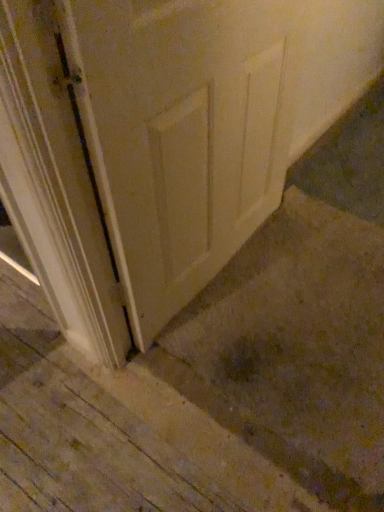
Describe the element at coordinates (213, 387) in the screenshot. I see `wooden at lower left` at that location.

I want to click on wooden at lower left, so click(213, 387).

What is the approximate height of wooden at lower left?

wooden at lower left is 4.00 centimeters in height.

What are the coordinates of `wooden at lower left` in the screenshot? It's located at (213, 387).